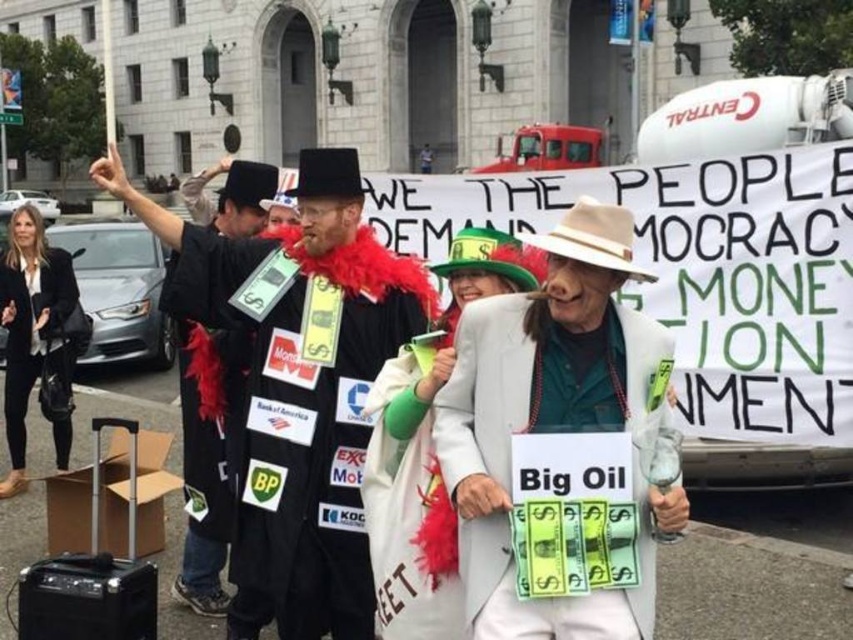
You are a photographer trying to capture both the black felt coat at center and the black leather jacket at lower left in a single frame. Based on their positions, which object should you focus on first to ensure both are in the shot?

The black felt coat at center is to the right of black leather jacket at lower left. To capture both in a single frame, focus on the black leather jacket at lower left first, as it is positioned further left and closer to the edge of the frame, allowing you to adjust the camera angle to include the black felt coat at center to its right.

You are a photographer trying to capture a clear shot of both the black fabric coat at center and the black felt coat at center. Since your camera can only focus on one subject at a time, which coat should you focus on to ensure the other is still in the background? Explain your reasoning based on their sizes.

The black fabric coat at center has a lesser width compared to the black felt coat at center. Therefore, focusing on the larger black felt coat at center would keep the smaller black fabric coat at center in the background within the depth of field.

You are a photographer at the protest scene. You need to capture a photo where both the white fabric suit at center and the white fabric coat at center are visible. Which one will appear shorter in your photo?

The white fabric suit at center will appear shorter in the photo because it is shorter than the white fabric coat at center according to the description.